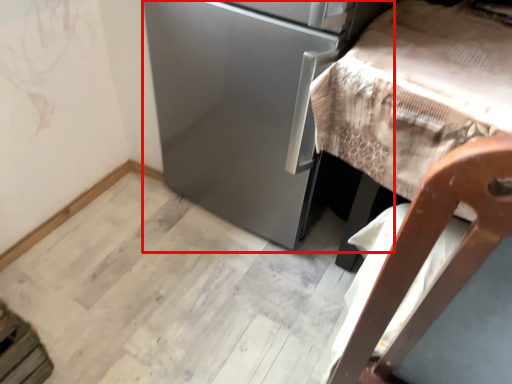
Question: Observing the image, what is the correct spatial positioning of appliance (annotated by the red box) in reference to furniture?

Choices:
 (A) left
 (B) right

Answer: (A)